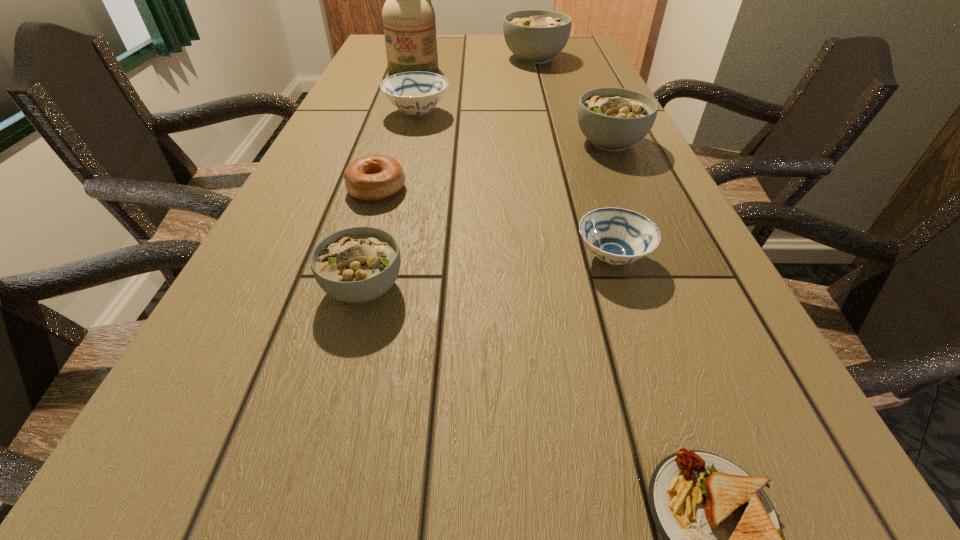
At what (x,y) coordinates should I click in order to perform the action: click on the smaller blue soup bowl. Please return your answer as a coordinate pair (x, y). Image resolution: width=960 pixels, height=540 pixels. Looking at the image, I should click on (617, 236).

Find the location of a particular element. The image size is (960, 540). the fourth nearest object is located at coordinates (373, 177).

The height and width of the screenshot is (540, 960). What are the coordinates of `free spot located 0.280m on the front label of the cleansing agent` in the screenshot? It's located at (398, 122).

Locate an element on the screen. vacant space situated on the front of the farthest soup bowl is located at coordinates (540, 78).

You are a GUI agent. You are given a task and a screenshot of the screen. Output one action in this format:
    pyautogui.click(x=<x>, y=<y>)
    Task: Click on the vacant region located on the left of the sixth shortest object
    The width and height of the screenshot is (960, 540).
    Given the screenshot: What is the action you would take?
    pyautogui.click(x=452, y=143)

Identify the location of free space located 0.210m on the back of the bigger blue soup bowl. The image size is (960, 540). (427, 72).

You are a GUI agent. You are given a task and a screenshot of the screen. Output one action in this format:
    pyautogui.click(x=<x>, y=<y>)
    Task: Click on the blank space located on the front of the leftmost white soup bowl
    
    Given the screenshot: What is the action you would take?
    pyautogui.click(x=338, y=385)

The height and width of the screenshot is (540, 960). Find the location of `vacant area situated 0.160m on the front of the smaller blue soup bowl`. vacant area situated 0.160m on the front of the smaller blue soup bowl is located at coordinates (649, 372).

Find the location of a particular element. The height and width of the screenshot is (540, 960). free location located on the back of the bagel is located at coordinates (388, 155).

This screenshot has width=960, height=540. I want to click on object that is positioned at the far edge, so click(x=535, y=36).